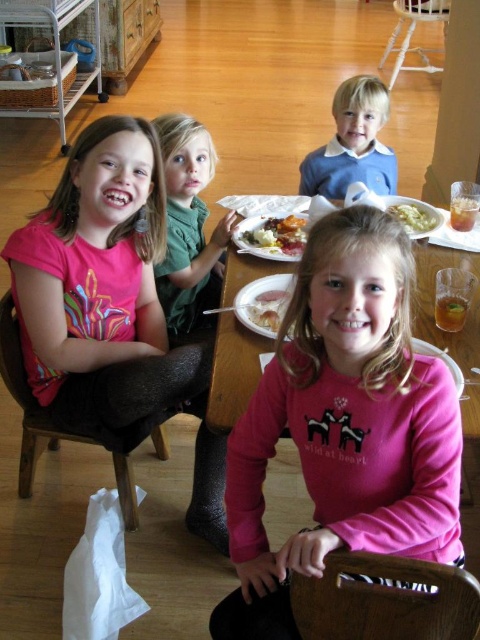
You are a photographer standing at the entrance of the room. You want to take a picture of the blue wool sweater at upper center. Where should you position yourself to capture it in the frame?

The blue wool sweater at upper center is located at point 0.225 on the horizontal axis and 0.735 on the vertical axis. To capture it in the frame, position yourself so that your camera is aligned with these coordinates.

You are a delivery robot with a 1.2 meter wide package. You need to pass between the two points marked as point (28, 339) and another point. Can you fit through the space between them?

The distance between the two points marked as point (28, 339) and the other point is 1.53 meters. Since the package is 1.2 meters wide, the robot can fit through the space between them as it is wider than the package.